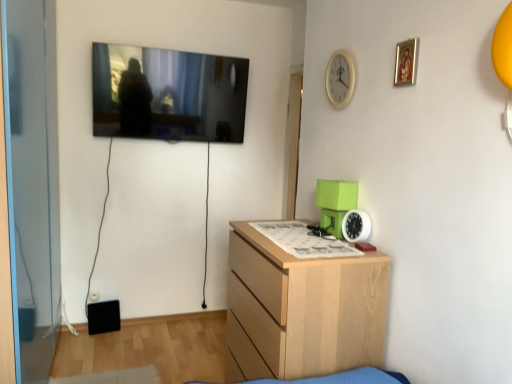
What is the approximate height of white plastic clock at right, arranged as the 2th clock when viewed from the top?

white plastic clock at right, arranged as the 2th clock when viewed from the top, is 14.95 centimeters tall.

Describe the element at coordinates (168, 94) in the screenshot. I see `flat screen tv at upper left` at that location.

Image resolution: width=512 pixels, height=384 pixels. In order to click on flat screen tv at upper left in this screenshot , I will do `click(168, 94)`.

What is the approximate width of light wood chest of drawers at lower right?

20.04 inches.

Where is `gold-framed picture at upper right`? gold-framed picture at upper right is located at coordinates (406, 62).

You are a GUI agent. You are given a task and a screenshot of the screen. Output one action in this format:
    pyautogui.click(x=<x>, y=<y>)
    Task: Click on the white plastic clock at right, arranged as the 2th clock when viewed from the top
    
    Given the screenshot: What is the action you would take?
    pyautogui.click(x=356, y=226)

From a real-world perspective, is light wood chest of drawers at lower right under gold-framed picture at upper right?

Yes, from a real-world perspective, light wood chest of drawers at lower right is beneath gold-framed picture at upper right.

Between light wood chest of drawers at lower right and gold-framed picture at upper right, which one appears on the right side from the viewer's perspective?

Positioned to the right is gold-framed picture at upper right.

Does light wood chest of drawers at lower right turn towards gold-framed picture at upper right?

No, light wood chest of drawers at lower right does not turn towards gold-framed picture at upper right.

Is light wood chest of drawers at lower right beside gold-framed picture at upper right?

No, light wood chest of drawers at lower right is not making contact with gold-framed picture at upper right.

From the image's perspective, between light wood chest of drawers at lower right and white wooden clock at upper center, the second clock from the bottom, who is located below?

light wood chest of drawers at lower right, from the image's perspective.

Where is `chest of drawers on the left of white wooden clock at upper center, the 1th clock from the top`? This screenshot has width=512, height=384. chest of drawers on the left of white wooden clock at upper center, the 1th clock from the top is located at coordinates click(302, 309).

Between point (309, 285) and point (331, 85), which one is positioned behind?

The point (331, 85) is farther.

Can you confirm if light wood chest of drawers at lower right is taller than white wooden clock at upper center, the second clock from the bottom?

Correct, light wood chest of drawers at lower right is much taller as white wooden clock at upper center, the second clock from the bottom.

Is white plastic clock at right, the 1th clock from the bottom, facing towards white wooden clock at upper center, the second clock from the bottom?

No, white plastic clock at right, the 1th clock from the bottom, does not turn towards white wooden clock at upper center, the second clock from the bottom.

From a real-world perspective, is white plastic clock at right, the 1th clock from the bottom, positioned above or below white wooden clock at upper center, the 1th clock from the top?

In terms of real-world spatial position, white plastic clock at right, the 1th clock from the bottom, is below white wooden clock at upper center, the 1th clock from the top.

How distant is white plastic clock at right, the 1th clock from the bottom, from white wooden clock at upper center, the second clock from the bottom?

white plastic clock at right, the 1th clock from the bottom, and white wooden clock at upper center, the second clock from the bottom, are 25.90 inches apart from each other.

Considering the sizes of objects white plastic clock at right, the 1th clock from the bottom, and white wooden clock at upper center, the 1th clock from the top, in the image provided, who is thinner, white plastic clock at right, the 1th clock from the bottom, or white wooden clock at upper center, the 1th clock from the top,?

With smaller width is white wooden clock at upper center, the 1th clock from the top.

Measure the distance from gold-framed picture at upper right to white plastic clock at right, the 1th clock from the bottom.

gold-framed picture at upper right and white plastic clock at right, the 1th clock from the bottom, are 26.56 inches apart from each other.

Considering the sizes of objects gold-framed picture at upper right and white plastic clock at right, the 1th clock from the bottom, in the image provided, who is taller, gold-framed picture at upper right or white plastic clock at right, the 1th clock from the bottom,?

With more height is gold-framed picture at upper right.

Which of these two, gold-framed picture at upper right or white plastic clock at right, the 1th clock from the bottom, is thinner?

gold-framed picture at upper right.

Is the depth of gold-framed picture at upper right greater than that of white plastic clock at right, arranged as the 2th clock when viewed from the top?

That is False.

From a real-world perspective, which object stands above the other?

flat screen tv at upper left, from a real-world perspective.

Which object is wider, white plastic clock at right, the 1th clock from the bottom, or flat screen tv at upper left?

flat screen tv at upper left is wider.

Can you tell me how much white plastic clock at right, arranged as the 2th clock when viewed from the top, and flat screen tv at upper left differ in facing direction?

88.4 degrees.

From the image's perspective, is white plastic clock at right, arranged as the 2th clock when viewed from the top, above or below flat screen tv at upper left?

white plastic clock at right, arranged as the 2th clock when viewed from the top, is situated lower than flat screen tv at upper left in the image.

Based on their sizes in the image, would you say flat screen tv at upper left is bigger or smaller than gold-framed picture at upper right?

flat screen tv at upper left is bigger than gold-framed picture at upper right.

Can you confirm if flat screen tv at upper left is wider than gold-framed picture at upper right?

Indeed, flat screen tv at upper left has a greater width compared to gold-framed picture at upper right.

Is there a large distance between flat screen tv at upper left and gold-framed picture at upper right?

Indeed, flat screen tv at upper left is not near gold-framed picture at upper right.

In the scene shown: Which point is more forward, (101, 65) or (401, 52)?

Point (401, 52)

Who is bigger, gold-framed picture at upper right or flat screen tv at upper left?

flat screen tv at upper left.

From a real-world perspective, which object rests below the other?

flat screen tv at upper left is physically lower.

Is point (402, 52) closer or farther from the camera than point (108, 105)?

Point (402, 52) is closer to the camera than point (108, 105).

Which is more to the right, gold-framed picture at upper right or flat screen tv at upper left?

gold-framed picture at upper right is more to the right.

This screenshot has width=512, height=384. Identify the location of picture frame above the light wood chest of drawers at lower right (from a real-world perspective). (406, 62).

Identify the location of chest of drawers that is on the left side of white wooden clock at upper center, the 1th clock from the top. (302, 309).

Based on their spatial positions, is white plastic clock at right, the 1th clock from the bottom, or flat screen tv at upper left further from gold-framed picture at upper right?

The object further to gold-framed picture at upper right is flat screen tv at upper left.

Based on their spatial positions, is white wooden clock at upper center, the 1th clock from the top, or white plastic clock at right, the 1th clock from the bottom, further from light wood chest of drawers at lower right?

white wooden clock at upper center, the 1th clock from the top.

Looking at the image, which one is located closer to light wood chest of drawers at lower right, white wooden clock at upper center, the 1th clock from the top, or flat screen tv at upper left?

white wooden clock at upper center, the 1th clock from the top, lies closer to light wood chest of drawers at lower right than the other object.

Estimate the real-world distances between objects in this image. Which object is further from white wooden clock at upper center, the 1th clock from the top, flat screen tv at upper left or white plastic clock at right, the 1th clock from the bottom?

Among the two, flat screen tv at upper left is located further to white wooden clock at upper center, the 1th clock from the top.

Looking at the image, which one is located further to white wooden clock at upper center, the second clock from the bottom, gold-framed picture at upper right or light wood chest of drawers at lower right?

The object further to white wooden clock at upper center, the second clock from the bottom, is light wood chest of drawers at lower right.

Estimate the real-world distances between objects in this image. Which object is closer to flat screen tv at upper left, white wooden clock at upper center, the 1th clock from the top, or gold-framed picture at upper right?

white wooden clock at upper center, the 1th clock from the top.

Considering their positions, is white plastic clock at right, arranged as the 2th clock when viewed from the top, positioned further to white wooden clock at upper center, the 1th clock from the top, than light wood chest of drawers at lower right?

light wood chest of drawers at lower right lies further to white wooden clock at upper center, the 1th clock from the top, than the other object.

Looking at the image, which one is located closer to light wood chest of drawers at lower right, white wooden clock at upper center, the 1th clock from the top, or gold-framed picture at upper right?

white wooden clock at upper center, the 1th clock from the top, is positioned closer to the anchor light wood chest of drawers at lower right.

Where is `picture frame between flat screen tv at upper left and light wood chest of drawers at lower right vertically`? This screenshot has height=384, width=512. picture frame between flat screen tv at upper left and light wood chest of drawers at lower right vertically is located at coordinates (406, 62).

Locate an element on the screen. The width and height of the screenshot is (512, 384). clock that lies between white wooden clock at upper center, the 1th clock from the top, and light wood chest of drawers at lower right from top to bottom is located at coordinates (356, 226).

At what (x,y) coordinates should I click in order to perform the action: click on picture frame between white wooden clock at upper center, the 1th clock from the top, and light wood chest of drawers at lower right from top to bottom. Please return your answer as a coordinate pair (x, y). Looking at the image, I should click on [406, 62].

Where is `picture frame between white wooden clock at upper center, the 1th clock from the top, and white plastic clock at right, arranged as the 2th clock when viewed from the top, in the vertical direction`? The width and height of the screenshot is (512, 384). picture frame between white wooden clock at upper center, the 1th clock from the top, and white plastic clock at right, arranged as the 2th clock when viewed from the top, in the vertical direction is located at coordinates (406, 62).